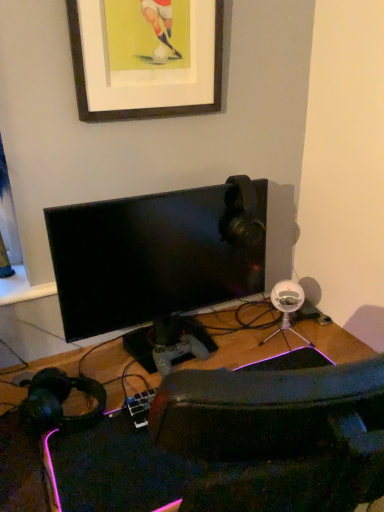
The image size is (384, 512). Find the location of `vacant area to the right of black glossy monitor at center`. vacant area to the right of black glossy monitor at center is located at coordinates (266, 337).